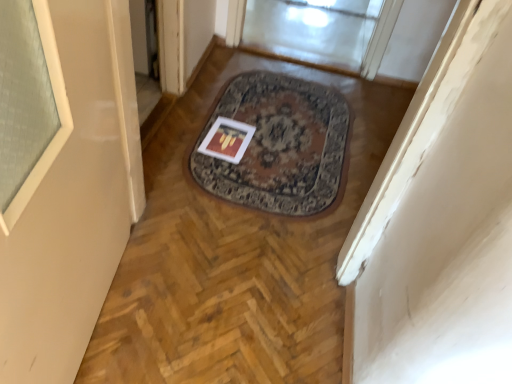
This screenshot has height=384, width=512. I want to click on free space to the right of matte paper postcard at center, so click(275, 150).